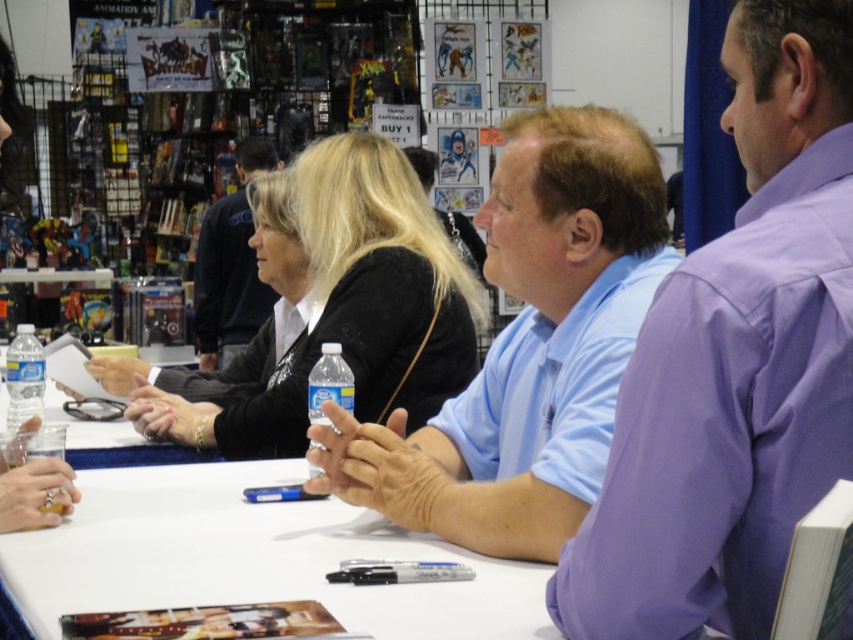
You are a photographer at the event and want to capture a closeup shot of the light blue shirt at center and the clear plastic water bottle at center. Which object will appear wider in the photo?

The light blue shirt at center will appear wider in the photo because its width surpasses that of the clear plastic water bottle at center.

You are a photographer at the event and want to ensure both the light blue shirt at center and the clear plastic water bottle at left are clearly visible in your photo. Given their sizes, which object should you focus on first to ensure proper focus?

The light blue shirt at center has a larger size compared to the clear plastic water bottle at left, so you should focus on the light blue shirt at center first to ensure proper focus.

You are standing at the entrance of the convention hall and want to find the person wearing the light blue shirt at center. According to the scene description, where should you look to locate them?

The light blue shirt at center is located at point (527, 348), so you should look towards the center area of the image, slightly to the right and lower middle section to find the person wearing the light blue shirt at center.